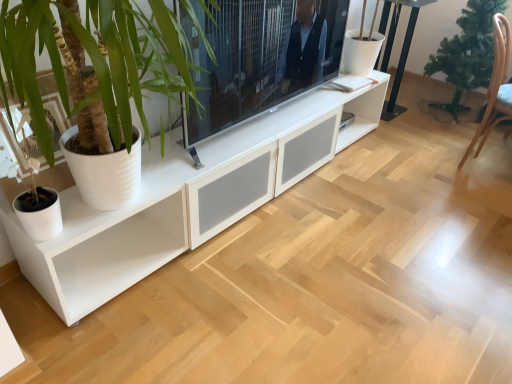
Question: Does brown wooden armchair at right have a lesser height compared to green matte christmas tree at right?

Choices:
 (A) no
 (B) yes

Answer: (B)

Question: Would you say green matte christmas tree at right is part of brown wooden armchair at right's contents?

Choices:
 (A) no
 (B) yes

Answer: (A)

Question: Is brown wooden armchair at right not near green matte christmas tree at right?

Choices:
 (A) no
 (B) yes

Answer: (A)

Question: Is brown wooden armchair at right outside green matte christmas tree at right?

Choices:
 (A) no
 (B) yes

Answer: (B)

Question: Does brown wooden armchair at right appear on the left side of green matte christmas tree at right?

Choices:
 (A) yes
 (B) no

Answer: (A)

Question: Considering their positions, is brown wooden armchair at right located in front of or behind green matte christmas tree at right?

Choices:
 (A) behind
 (B) front

Answer: (B)

Question: From their relative heights in the image, would you say brown wooden armchair at right is taller or shorter than green matte christmas tree at right?

Choices:
 (A) tall
 (B) short

Answer: (B)

Question: Based on their sizes in the image, would you say brown wooden armchair at right is bigger or smaller than green matte christmas tree at right?

Choices:
 (A) small
 (B) big

Answer: (A)

Question: From the image's perspective, is brown wooden armchair at right positioned above or below green matte christmas tree at right?

Choices:
 (A) above
 (B) below

Answer: (B)

Question: Is point (492, 114) closer or farther from the camera than point (222, 125)?

Choices:
 (A) farther
 (B) closer

Answer: (A)

Question: Visually, is brown wooden armchair at right positioned to the left or to the right of matte black tv at center?

Choices:
 (A) right
 (B) left

Answer: (A)

Question: Is brown wooden armchair at right bigger or smaller than matte black tv at center?

Choices:
 (A) small
 (B) big

Answer: (B)

Question: In terms of height, does brown wooden armchair at right look taller or shorter compared to matte black tv at center?

Choices:
 (A) tall
 (B) short

Answer: (A)

Question: In the image, is green matte christmas tree at right on the left side or the right side of black metal table at upper right?

Choices:
 (A) left
 (B) right

Answer: (B)

Question: Considering the positions of point (451, 59) and point (408, 49), is point (451, 59) closer or farther from the camera than point (408, 49)?

Choices:
 (A) closer
 (B) farther

Answer: (B)